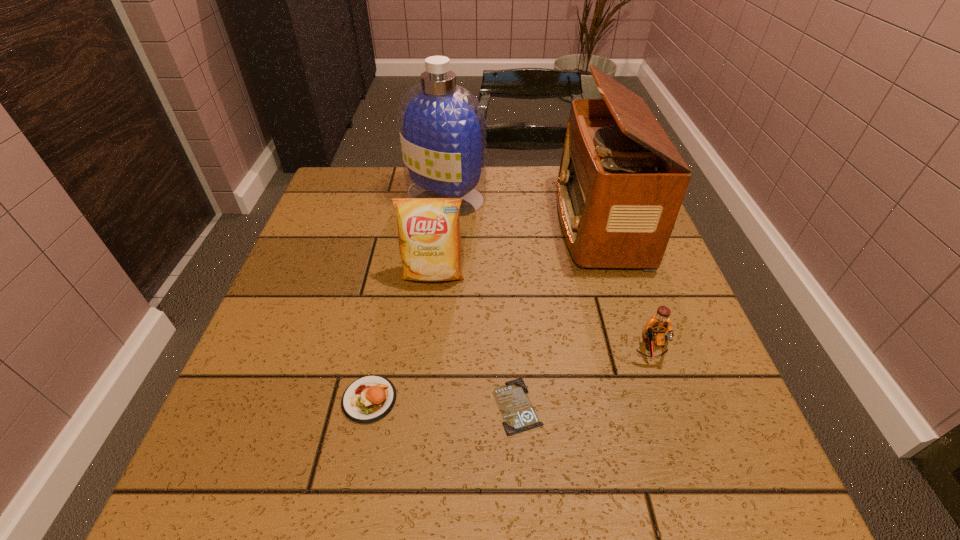
You are a GUI agent. You are given a task and a screenshot of the screen. Output one action in this format:
    pyautogui.click(x=<x>, y=<y>)
    Task: Click on the object that is positioned at the far right corner
    The image size is (960, 540).
    Given the screenshot: What is the action you would take?
    pyautogui.click(x=618, y=196)

Locate an element on the screen. free space at the far edge is located at coordinates [494, 194].

Locate an element on the screen. free space at the near edge of the desktop is located at coordinates (545, 494).

Where is `free location at the left edge`? The width and height of the screenshot is (960, 540). free location at the left edge is located at coordinates (347, 320).

Where is `free space at the right edge`? free space at the right edge is located at coordinates (695, 350).

You are a GUI agent. You are given a task and a screenshot of the screen. Output one action in this format:
    pyautogui.click(x=<x>, y=<y>)
    Task: Click on the free space at the far left corner of the desktop
    The width and height of the screenshot is (960, 540).
    Given the screenshot: What is the action you would take?
    point(344,210)

In order to click on free space at the near right corner of the desktop in this screenshot , I will do `click(710, 496)`.

I want to click on unoccupied area between the third shortest object and the patty (food), so click(x=510, y=374).

Image resolution: width=960 pixels, height=540 pixels. In order to click on blank region between the shortest object and the cleansing agent in this screenshot , I will do `click(481, 301)`.

The width and height of the screenshot is (960, 540). Find the location of `vacant region between the fourth object from left to right and the patty (food)`. vacant region between the fourth object from left to right and the patty (food) is located at coordinates (444, 402).